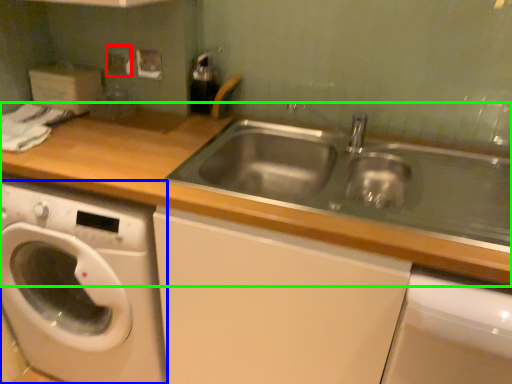
Question: Which object is the closest to the electric outlet (highlighted by a red box)? Choose among these: washing machine (highlighted by a blue box) or countertop (highlighted by a green box).

Choices:
 (A) washing machine
 (B) countertop

Answer: (B)